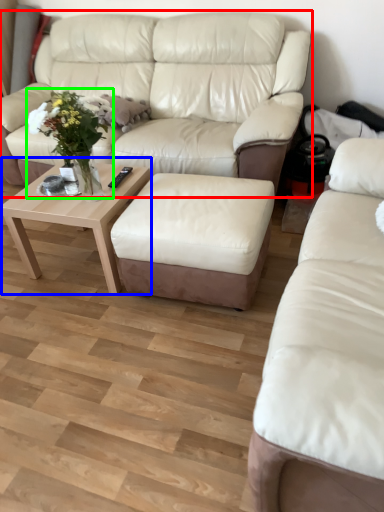
Question: Estimate the real-world distances between objects in this image. Which object is farther from studio couch (highlighted by a red box), coffee table (highlighted by a blue box) or floral arrangement (highlighted by a green box)?

Choices:
 (A) coffee table
 (B) floral arrangement

Answer: (B)